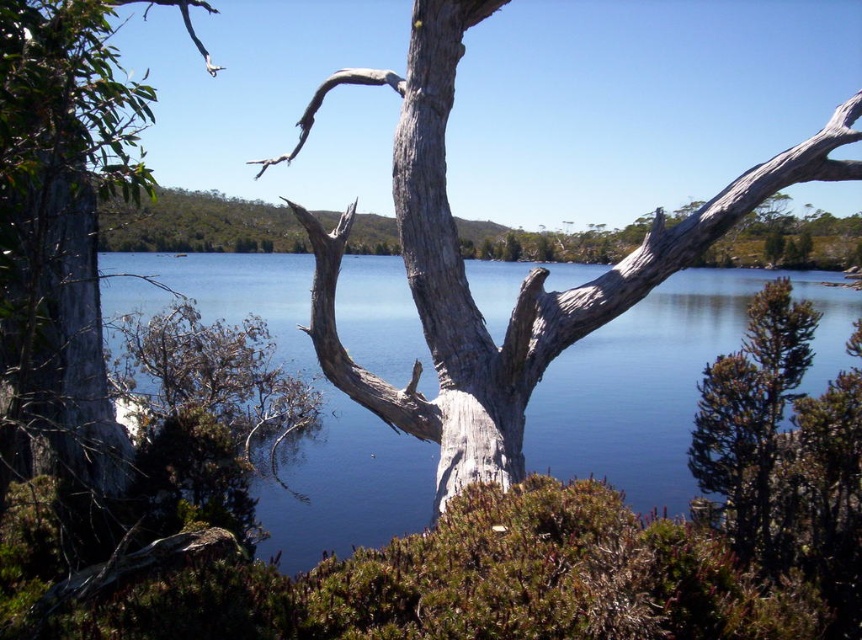
Question: Among these points, which one is nearest to the camera?

Choices:
 (A) (595, 333)
 (B) (44, 456)

Answer: (B)

Question: Among these objects, which one is nearest to the camera?

Choices:
 (A) blue water at center
 (B) gray rough bark tree at left

Answer: (B)

Question: Can you confirm if blue water at center is smaller than gray rough bark tree at left?

Choices:
 (A) no
 (B) yes

Answer: (B)

Question: Which point appears farthest from the camera in this image?

Choices:
 (A) (292, 317)
 (B) (28, 282)

Answer: (A)

Question: Does blue water at center appear over gray rough bark tree at left?

Choices:
 (A) yes
 (B) no

Answer: (B)

Question: Is blue water at center thinner than gray rough bark tree at left?

Choices:
 (A) no
 (B) yes

Answer: (A)